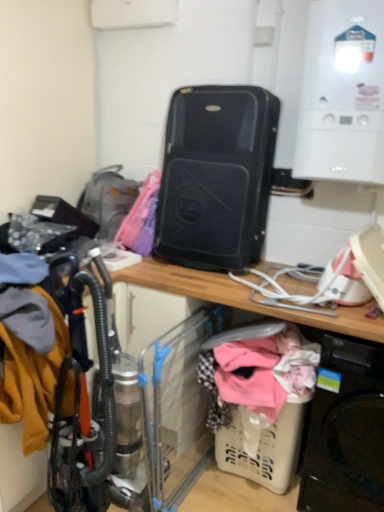
Question: Is black plastic washing machine at lower right positioned beyond the bounds of matte gray backpack at left?

Choices:
 (A) yes
 (B) no

Answer: (A)

Question: Can you confirm if black plastic washing machine at lower right is taller than matte gray backpack at left?

Choices:
 (A) yes
 (B) no

Answer: (A)

Question: Considering the relative sizes of black plastic washing machine at lower right and matte gray backpack at left in the image provided, is black plastic washing machine at lower right wider than matte gray backpack at left?

Choices:
 (A) yes
 (B) no

Answer: (A)

Question: Is the depth of black plastic washing machine at lower right less than that of matte gray backpack at left?

Choices:
 (A) no
 (B) yes

Answer: (B)

Question: Is black plastic washing machine at lower right to the right of matte gray backpack at left from the viewer's perspective?

Choices:
 (A) yes
 (B) no

Answer: (A)

Question: Does black plastic washing machine at lower right contain matte gray backpack at left?

Choices:
 (A) no
 (B) yes

Answer: (A)

Question: Is matte gray backpack at left in front of white glossy boiler at upper right?

Choices:
 (A) yes
 (B) no

Answer: (B)

Question: Is matte gray backpack at left looking in the opposite direction of white glossy boiler at upper right?

Choices:
 (A) yes
 (B) no

Answer: (B)

Question: Considering the relative sizes of matte gray backpack at left and white glossy boiler at upper right in the image provided, is matte gray backpack at left thinner than white glossy boiler at upper right?

Choices:
 (A) no
 (B) yes

Answer: (A)

Question: Is matte gray backpack at left positioned behind white glossy boiler at upper right?

Choices:
 (A) yes
 (B) no

Answer: (A)

Question: Is matte gray backpack at left wider than white glossy boiler at upper right?

Choices:
 (A) yes
 (B) no

Answer: (A)

Question: From the image's perspective, is matte gray backpack at left located beneath white glossy boiler at upper right?

Choices:
 (A) no
 (B) yes

Answer: (B)

Question: Is plastic/transparent baby carriage at lower center wider than black matte suitcase at center?

Choices:
 (A) no
 (B) yes

Answer: (A)